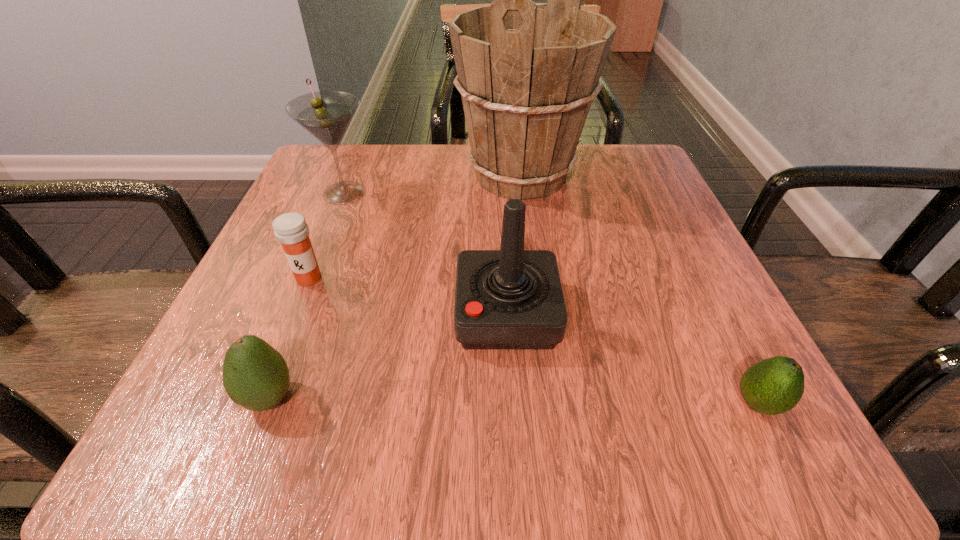
In the image, there is a desktop. At what (x,y) coordinates should I click in order to perform the action: click on free space at the near left corner. Please return your answer as a coordinate pair (x, y). Looking at the image, I should click on (283, 445).

Find the location of `free space at the far right corner`. free space at the far right corner is located at coordinates (621, 167).

At what (x,y) coordinates should I click in order to perform the action: click on free point between the joystick and the shorter avocado. Please return your answer as a coordinate pair (x, y). This screenshot has width=960, height=540. Looking at the image, I should click on (633, 359).

Find the location of a particular element. free space between the left avocado and the rightmost object is located at coordinates (514, 401).

This screenshot has height=540, width=960. Find the location of `free spot between the medicine and the left avocado`. free spot between the medicine and the left avocado is located at coordinates (289, 338).

What are the coordinates of `unoccupied area between the left avocado and the medicine` in the screenshot? It's located at (289, 338).

The height and width of the screenshot is (540, 960). What are the coordinates of `empty space between the martini and the taller avocado` in the screenshot? It's located at (306, 295).

Locate an element on the screen. Image resolution: width=960 pixels, height=540 pixels. vacant area between the martini and the medicine is located at coordinates (326, 235).

The image size is (960, 540). Find the location of `free point between the joystick and the rightmost object`. free point between the joystick and the rightmost object is located at coordinates (633, 359).

Find the location of `free space between the medicine and the bucket`. free space between the medicine and the bucket is located at coordinates (415, 227).